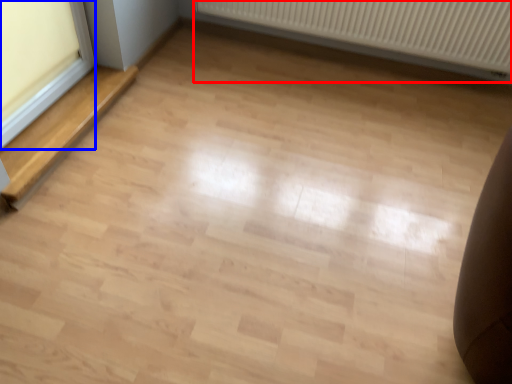
Question: Which object appears closest to the camera in this image, radiator (highlighted by a red box) or window frame (highlighted by a blue box)?

Choices:
 (A) radiator
 (B) window frame

Answer: (B)